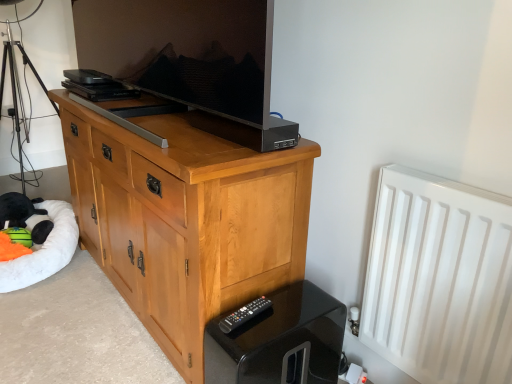
What do you see at coordinates (25, 216) in the screenshot? I see `black plush toy at lower left` at bounding box center [25, 216].

The image size is (512, 384). Identify the location of light wood cabinet at center. [186, 218].

At what (x,y) coordinates should I click in order to perform the action: click on matte black television at center. Please return your answer as a coordinate pair (x, y). Looking at the image, I should click on (197, 60).

Describe the element at coordinates (44, 251) in the screenshot. I see `white fluffy dog bed at lower left` at that location.

Describe the element at coordinates (279, 339) in the screenshot. Image resolution: width=512 pixels, height=384 pixels. I see `black glossy remote control at lower right` at that location.

Where is `black plastic remote at lower center`? The width and height of the screenshot is (512, 384). black plastic remote at lower center is located at coordinates (244, 314).

Could you tell me if black plastic remote at lower center is facing light wood cabinet at center?

No, black plastic remote at lower center is not facing towards light wood cabinet at center.

Is the depth of black plastic remote at lower center greater than that of light wood cabinet at center?

Yes, black plastic remote at lower center is behind light wood cabinet at center.

Which of these two, black plastic remote at lower center or light wood cabinet at center, is smaller?

With smaller size is black plastic remote at lower center.

Is light wood cabinet at center aimed at black glossy remote control at lower right?

No, light wood cabinet at center is not aimed at black glossy remote control at lower right.

Is black glossy remote control at lower right a part of light wood cabinet at center?

No, black glossy remote control at lower right is located outside of light wood cabinet at center.

Considering the positions of objects light wood cabinet at center and black glossy remote control at lower right in the image provided, who is behind, light wood cabinet at center or black glossy remote control at lower right?

black glossy remote control at lower right is more distant.

Measure the distance from black plush toy at lower left to black plastic remote at lower center.

A distance of 4.90 feet exists between black plush toy at lower left and black plastic remote at lower center.

Considering the sizes of black plush toy at lower left and black plastic remote at lower center in the image, is black plush toy at lower left bigger or smaller than black plastic remote at lower center?

Clearly, black plush toy at lower left is larger in size than black plastic remote at lower center.

Is black plush toy at lower left taller than black plastic remote at lower center?

Indeed, black plush toy at lower left has a greater height compared to black plastic remote at lower center.

From the image's perspective, is black metal tripod at left under white fluffy dog bed at lower left?

No, from the image's perspective, black metal tripod at left is not below white fluffy dog bed at lower left.

The height and width of the screenshot is (384, 512). I want to click on dog bed below the black metal tripod at left (from the image's perspective), so click(x=44, y=251).

From the picture: Are black metal tripod at left and white fluffy dog bed at lower left beside each other?

They are not placed beside each other.

Is black metal tripod at left in front of or behind white fluffy dog bed at lower left in the image?

black metal tripod at left is behind white fluffy dog bed at lower left.

Can you confirm if black plastic remote at lower center is positioned to the right of white matte radiator at right?

No, black plastic remote at lower center is not to the right of white matte radiator at right.

In order to click on radiator lying in front of the black plastic remote at lower center in this screenshot , I will do `click(439, 279)`.

Which is behind, black plastic remote at lower center or white matte radiator at right?

Positioned behind is black plastic remote at lower center.

Is black plastic remote at lower center bigger or smaller than white matte radiator at right?

black plastic remote at lower center is smaller than white matte radiator at right.

Based on their positions, is black metal tripod at left located to the left or right of black glossy remote control at lower right?

black metal tripod at left is to the left of black glossy remote control at lower right.

Is black metal tripod at left facing away from black glossy remote control at lower right?

That's not correct — black metal tripod at left is not looking away from black glossy remote control at lower right.

Can you confirm if black metal tripod at left is wider than black glossy remote control at lower right?

Indeed, black metal tripod at left has a greater width compared to black glossy remote control at lower right.

From a real-world perspective, which object stands above the other?

white matte radiator at right, from a real-world perspective.

Would you consider light wood cabinet at center to be distant from white matte radiator at right?

No.

Identify the location of radiator below the light wood cabinet at center (from the image's perspective). (439, 279).

Is light wood cabinet at center at the right side of white matte radiator at right?

Incorrect, light wood cabinet at center is not on the right side of white matte radiator at right.

Image resolution: width=512 pixels, height=384 pixels. I want to click on the chest of drawers above the black plastic remote at lower center (from the image's perspective), so click(186, 218).

The image size is (512, 384). I want to click on chest of drawers in front of the black glossy remote control at lower right, so click(x=186, y=218).

When comparing their distances from black metal tripod at left, does light wood cabinet at center or black plush toy at lower left seem further?

Among the two, light wood cabinet at center is located further to black metal tripod at left.

Considering their positions, is white fluffy dog bed at lower left positioned closer to black plastic remote at lower center than black metal tripod at left?

white fluffy dog bed at lower left.

Based on their spatial positions, is matte black television at center or black glossy remote control at lower right closer to black metal tripod at left?

matte black television at center is closer to black metal tripod at left.

Based on their spatial positions, is black plastic remote at lower center or white matte radiator at right closer to black glossy remote control at lower right?

Answer: black plastic remote at lower center.

Which object lies nearer to the anchor point white matte radiator at right, black glossy remote control at lower right or white fluffy dog bed at lower left?

black glossy remote control at lower right is positioned closer to the anchor white matte radiator at right.

Estimate the real-world distances between objects in this image. Which object is further from white matte radiator at right, black plastic remote at lower center or white fluffy dog bed at lower left?

white fluffy dog bed at lower left.

From the image, which object appears to be nearer to white fluffy dog bed at lower left, white matte radiator at right or black glossy remote control at lower right?

black glossy remote control at lower right is closer to white fluffy dog bed at lower left.

Looking at the image, which one is located further to white matte radiator at right, matte black television at center or white fluffy dog bed at lower left?

Based on the image, white fluffy dog bed at lower left appears to be further to white matte radiator at right.

The height and width of the screenshot is (384, 512). I want to click on dog bed between black metal tripod at left and black plastic remote at lower center in the horizontal direction, so click(x=44, y=251).

Locate an element on the screen. The image size is (512, 384). dog bed between light wood cabinet at center and black metal tripod at left along the z-axis is located at coordinates (44, 251).

Where is `animal that lies between black metal tripod at left and white fluffy dog bed at lower left from top to bottom`? Image resolution: width=512 pixels, height=384 pixels. animal that lies between black metal tripod at left and white fluffy dog bed at lower left from top to bottom is located at coordinates (25, 216).

Find the location of a particular element. remote between light wood cabinet at center and black glossy remote control at lower right in the horizontal direction is located at coordinates (244, 314).